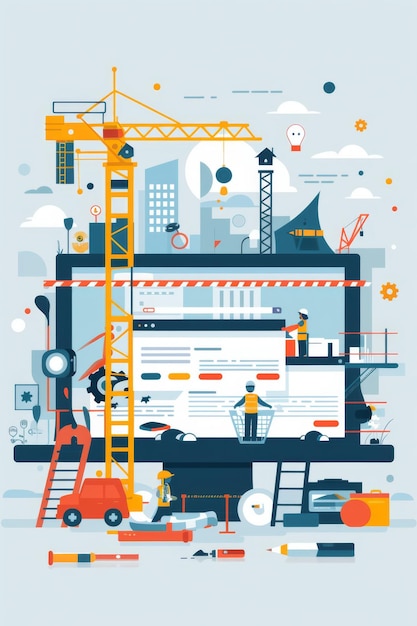
At what (x,y) coordinates should I click in order to perform the action: click on ladder. Please return your answer as a coordinate pair (x, y). The width and height of the screenshot is (417, 626). Looking at the image, I should click on (278, 483).